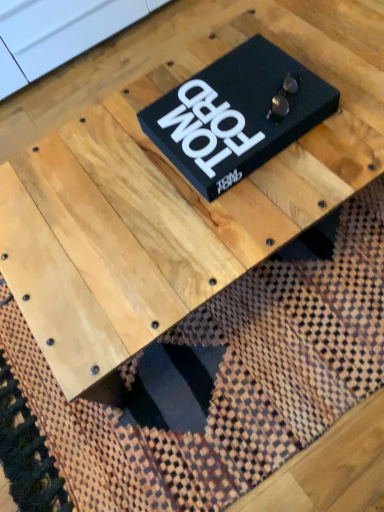
Image resolution: width=384 pixels, height=512 pixels. I want to click on black matte book at center, so click(236, 115).

Describe the element at coordinates (236, 115) in the screenshot. I see `black matte book at center` at that location.

Identify the location of black matte book at center. This screenshot has width=384, height=512. (236, 115).